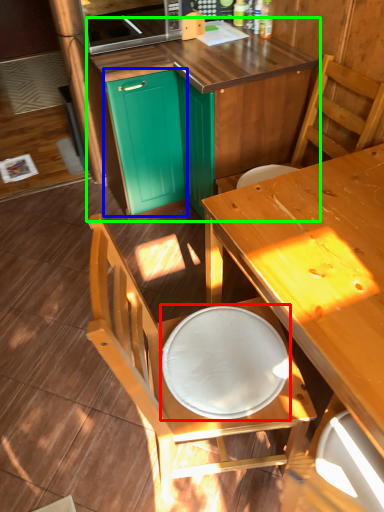
Question: Which object is positioned closest to round table (highlighted by a red box)? Select from cabinetry (highlighted by a blue box) and cabinetry (highlighted by a green box).

Choices:
 (A) cabinetry
 (B) cabinetry

Answer: (B)